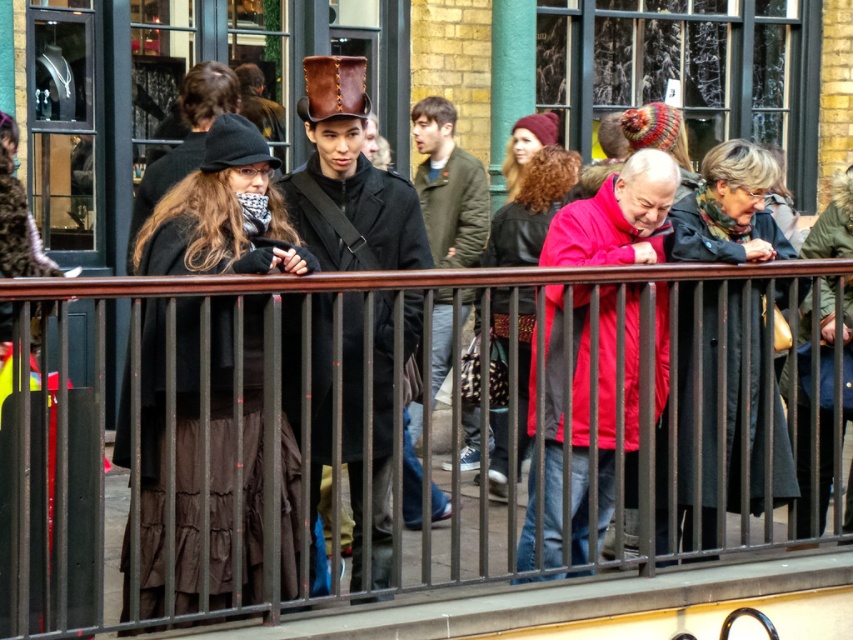
Question: Is red matte jacket at center bigger than dark gray wool coat at center?

Choices:
 (A) no
 (B) yes

Answer: (B)

Question: Considering the relative positions of brown metal fence at center and matte black coat at center in the image provided, where is brown metal fence at center located with respect to matte black coat at center?

Choices:
 (A) left
 (B) right

Answer: (B)

Question: Estimate the real-world distances between objects in this image. Which object is farther from the leather hat at center?

Choices:
 (A) green fuzzy coat at center
 (B) matte black coat at center
 (C) dark gray wool coat at center

Answer: (A)

Question: Based on their relative distances, which object is farther from the leather hat at center?

Choices:
 (A) brown metal fence at center
 (B) dark gray wool coat at center

Answer: (B)

Question: Does leather hat at center have a lesser width compared to red matte jacket at center?

Choices:
 (A) yes
 (B) no

Answer: (A)

Question: Among these objects, which one is farthest from the camera?

Choices:
 (A) red matte jacket at center
 (B) brown metal fence at center
 (C) matte black coat at center

Answer: (A)